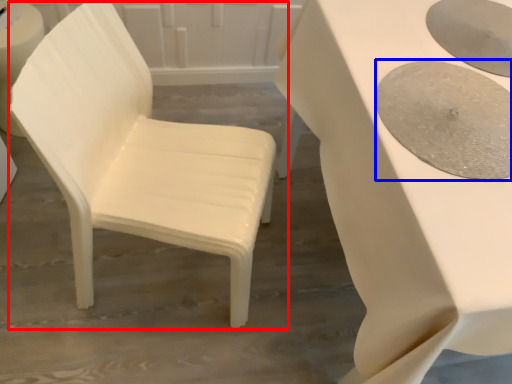
Question: Which point is closer to the camera, chair (highlighted by a red box) or oval (highlighted by a blue box)?

Choices:
 (A) chair
 (B) oval

Answer: (A)